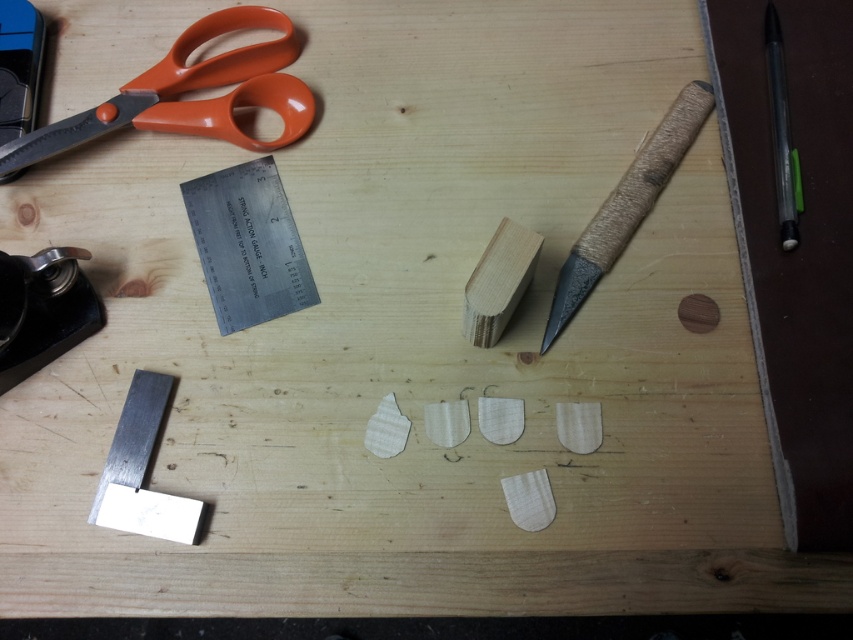
You are organizing the tools on the wooden workbench. The orange plastic scissors at upper left are needed for a task. Where exactly are they positioned relative to the other items on the bench?

The orange plastic scissors at upper left are located at point coordinates (x=189, y=90) on the workbench surface.

From the picture: You are an artist trying to locate your wooden textured pencil. You see the orange scissors on the left and the metal ruler in the center. Where should you look relative to the orange scissors and metal ruler to find the wooden textured pencil at upper right?

The wooden textured pencil at upper right is located at the coordinates point (625, 204), which is above and to the right of both the orange scissors on the left and the metal ruler in the center.

Based on the scene description and the objects listed, can you identify the object located at the coordinates point [625,204]?

The point [625,204] indicates the wooden textured pencil at upper right.